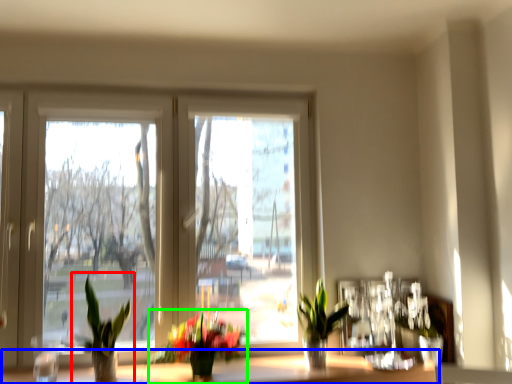
Question: Which object is positioned closest to houseplant (highlighted by a red box)? Select from window sill (highlighted by a blue box) and houseplant (highlighted by a green box).

Choices:
 (A) window sill
 (B) houseplant

Answer: (B)